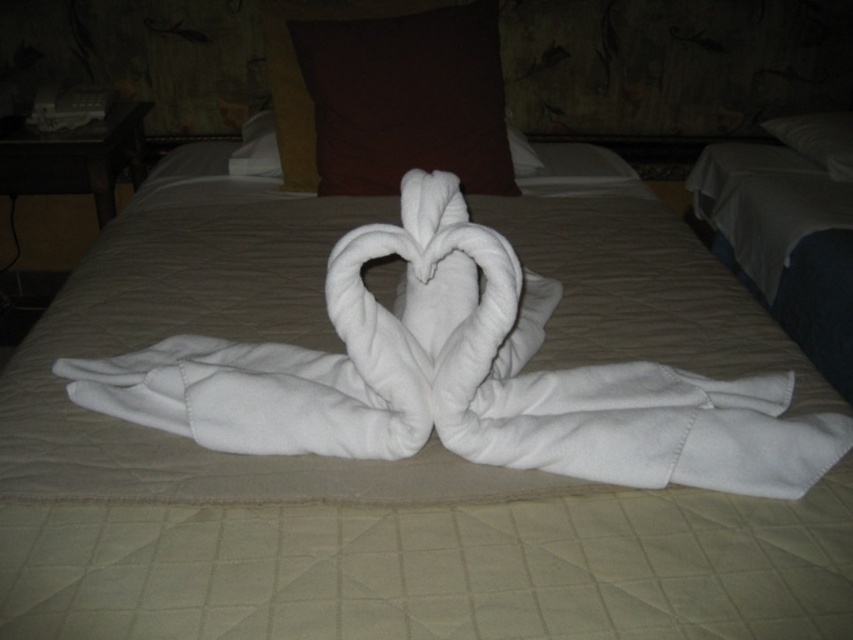
Looking at this image, you are arranging pillows on a bed and see the brown fabric pillow at upper center and the white soft pillow at upper center. Which pillow is located to the left of the other?

The brown fabric pillow at upper center is positioned on the left side of white soft pillow at upper center.

Based on the photo, you are standing at the foot of the bed and want to place a new decorative item on the brown fabric pillow at upper center. Based on its current position, where exactly is the brown fabric pillow located in relation to the bed?

The brown fabric pillow at upper center is located at point coordinates 0.155 along the horizontal axis and 0.477 along the vertical axis relative to the bed.

Looking at this image, you are standing in the room and want to reach a point that is 1.1 meters away from you. Can you confirm if the point at coordinates (78, 401) is within your reach?

The point at coordinates (78, 401) is 1.11 meters away from the camera, so it is just slightly out of reach if you need to reach exactly 1.1 meters.